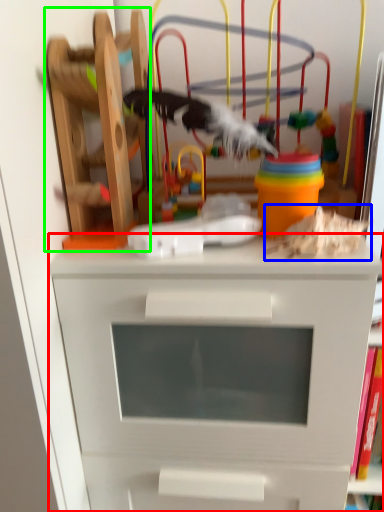
Question: Which object is positioned closest to chest of drawers (highlighted by a red box)? Select from toy (highlighted by a blue box) and toy (highlighted by a green box).

Choices:
 (A) toy
 (B) toy

Answer: (A)